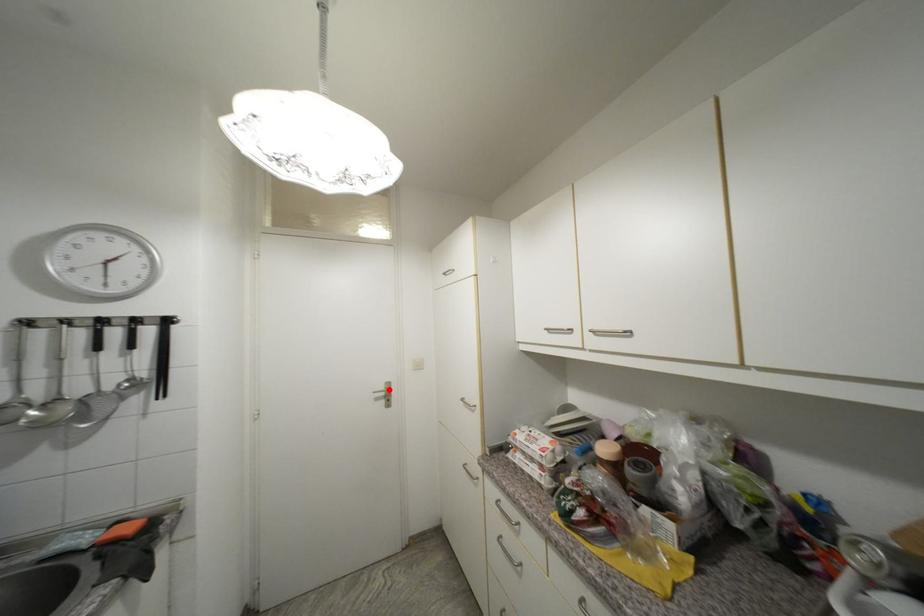
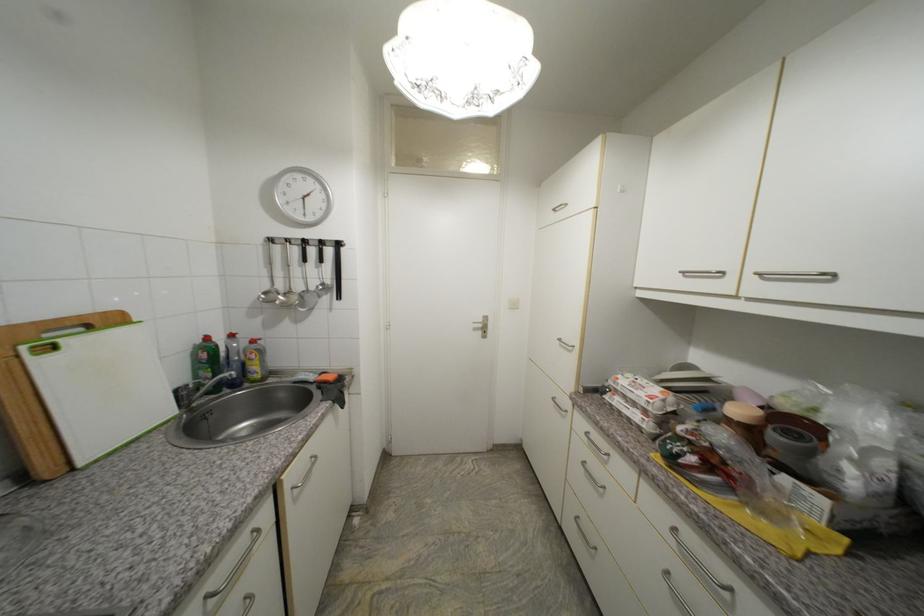
Question: I am providing you with two images of the same scene from different viewpoints. A red point is marked on the first image. Is the red point's position out of view in image 2?

Choices:
 (A) Yes
 (B) No

Answer: (B)